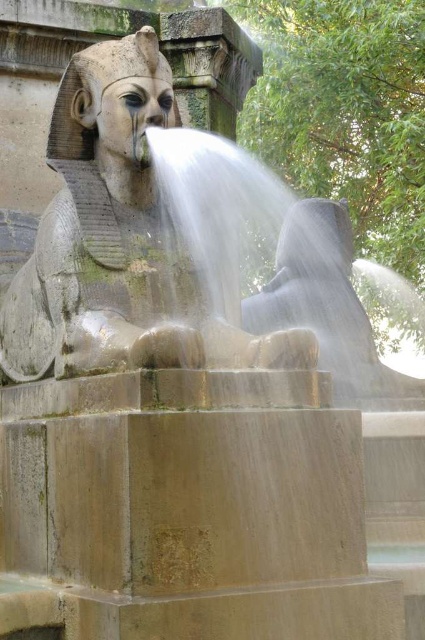
Between stone statue at center and clear water at sphinx center, which one is positioned lower?

stone statue at center is lower down.

Between point (105, 330) and point (384, 372), which one is positioned in front?

Point (105, 330) is more forward.

I want to click on stone statue at center, so [x=118, y=241].